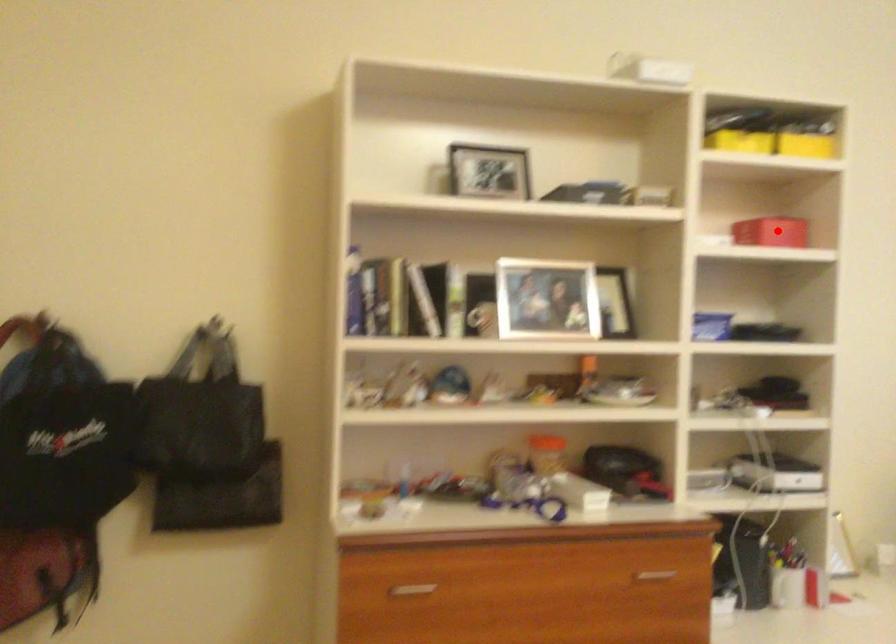
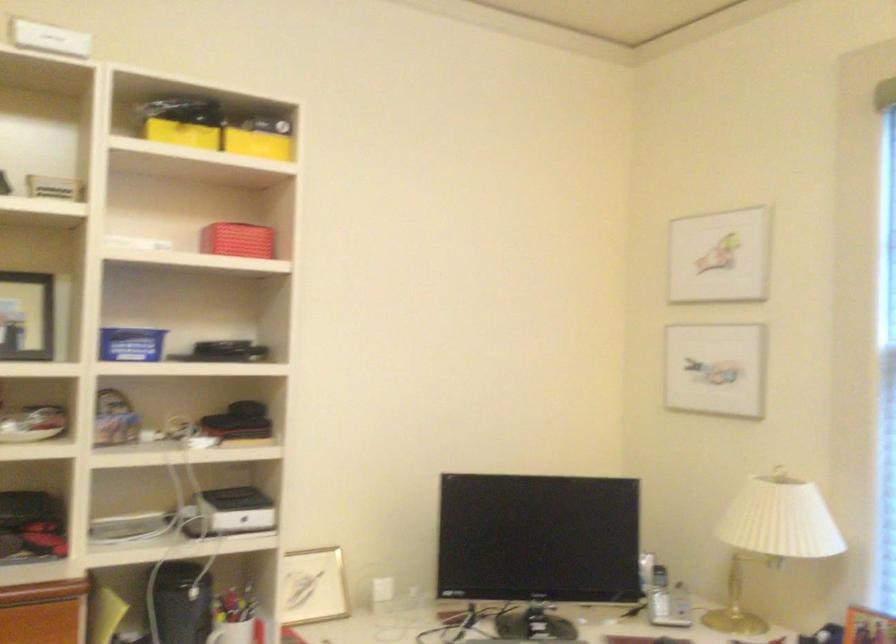
The point at the highlighted location is marked in the first image. Where is the corresponding point in the second image?

(237, 240)